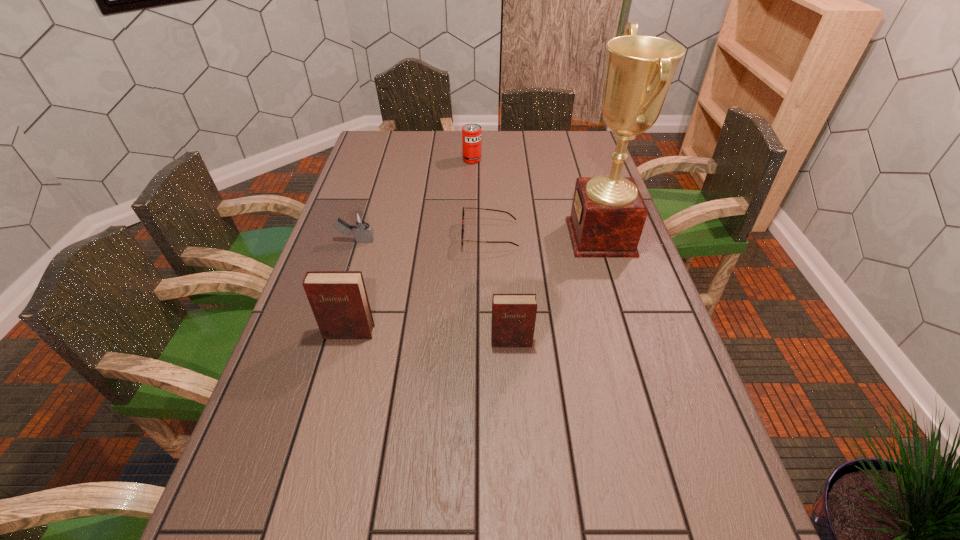
Point out which object is positioned as the fourth nearest to the farthest object. Please provide its 2D coordinates. Your answer should be formatted as a tuple, i.e. [(x, y)], where the tuple contains the x and y coordinates of a point satisfying the conditions above.

[(338, 299)]

Find the location of a particular element. vacant space that satisfies the following two spatial constraints: 1. on the back side of the igniter; 2. on the right side of the farthest object is located at coordinates (382, 160).

Where is `free point that satisfies the following two spatial constraints: 1. on the face of the shortest object; 2. on the front cover of the taller diary`? This screenshot has height=540, width=960. free point that satisfies the following two spatial constraints: 1. on the face of the shortest object; 2. on the front cover of the taller diary is located at coordinates (492, 333).

Locate an element on the screen. The width and height of the screenshot is (960, 540). free space that satisfies the following two spatial constraints: 1. on the face of the shortest object; 2. on the front cover of the left diary is located at coordinates (492, 333).